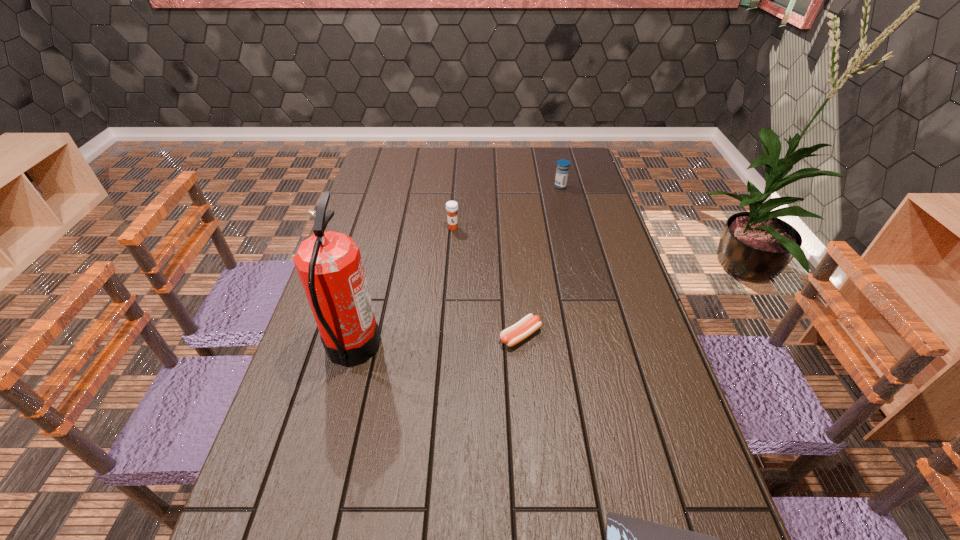
Find the location of a particular element. the leftmost object is located at coordinates (329, 264).

The height and width of the screenshot is (540, 960). In order to click on fire extinguisher in this screenshot , I will do `click(329, 264)`.

Locate an element on the screen. The width and height of the screenshot is (960, 540). the farther medicine is located at coordinates (562, 171).

Locate an element on the screen. Image resolution: width=960 pixels, height=540 pixels. the farthest object is located at coordinates (562, 171).

Where is `the fourth object from right to left`? Image resolution: width=960 pixels, height=540 pixels. the fourth object from right to left is located at coordinates (451, 206).

Identify the location of the left medicine. Image resolution: width=960 pixels, height=540 pixels. (451, 206).

Locate an element on the screen. The height and width of the screenshot is (540, 960). the third object from left to right is located at coordinates (528, 325).

At what (x,y) coordinates should I click in order to perform the action: click on sausage. Please return your answer as a coordinate pair (x, y). The width and height of the screenshot is (960, 540). Looking at the image, I should click on (528, 325).

You are a GUI agent. You are given a task and a screenshot of the screen. Output one action in this format:
    pyautogui.click(x=<x>, y=<y>)
    Task: Click on the free space located 0.090m on the front side of the tallest object
    The height and width of the screenshot is (540, 960).
    Given the screenshot: What is the action you would take?
    pyautogui.click(x=414, y=349)

You are a GUI agent. You are given a task and a screenshot of the screen. Output one action in this format:
    pyautogui.click(x=<x>, y=<y>)
    Task: Click on the free space located 0.160m on the left of the farthest object
    This screenshot has height=540, width=960.
    Given the screenshot: What is the action you would take?
    pyautogui.click(x=513, y=186)